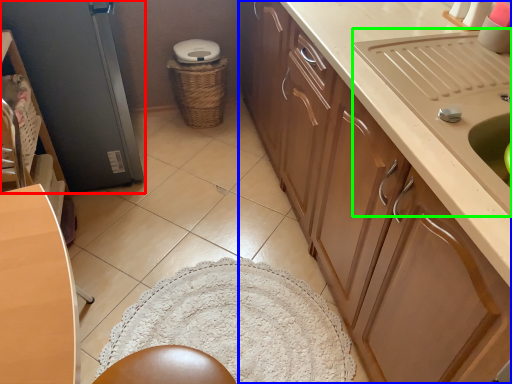
Question: Estimate the real-world distances between objects in this image. Which object is closer to screen door (highlighted by a red box), cabinetry (highlighted by a blue box) or sink (highlighted by a green box)?

Choices:
 (A) cabinetry
 (B) sink

Answer: (A)